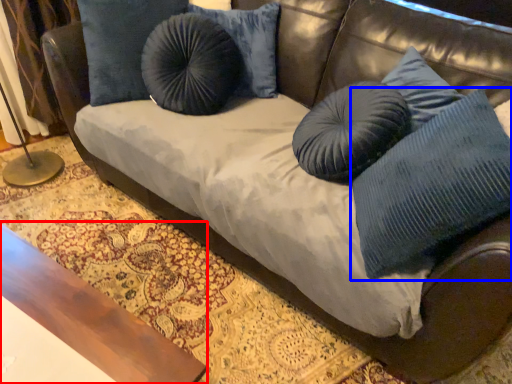
Question: Which point is closer to the camera, table (highlighted by a red box) or pillow (highlighted by a blue box)?

Choices:
 (A) table
 (B) pillow

Answer: (A)